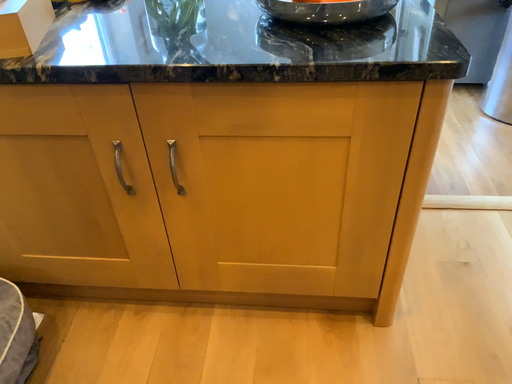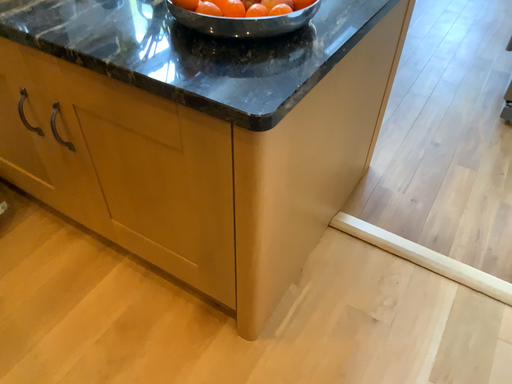
Question: How did the camera likely rotate when shooting the video?

Choices:
 (A) rotated left
 (B) rotated right

Answer: (A)